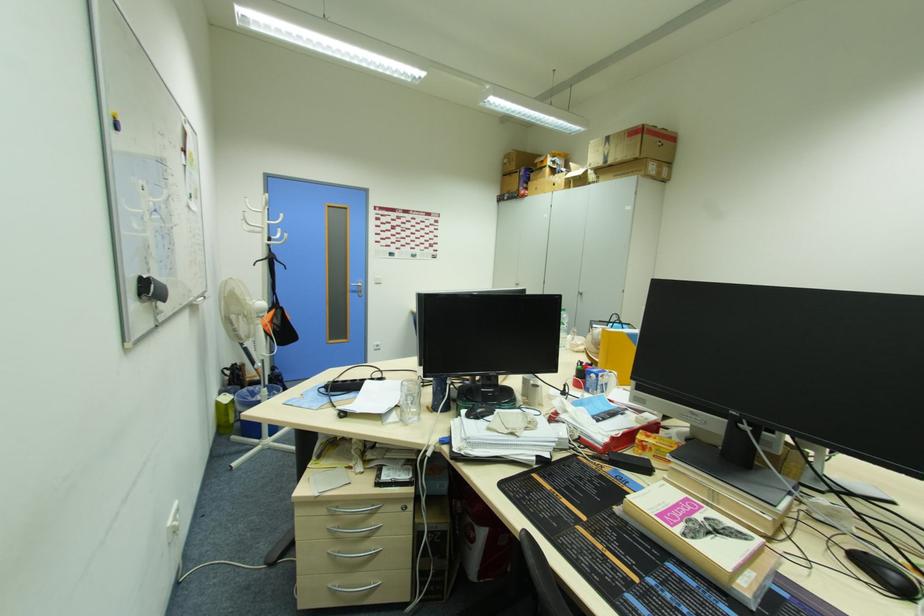
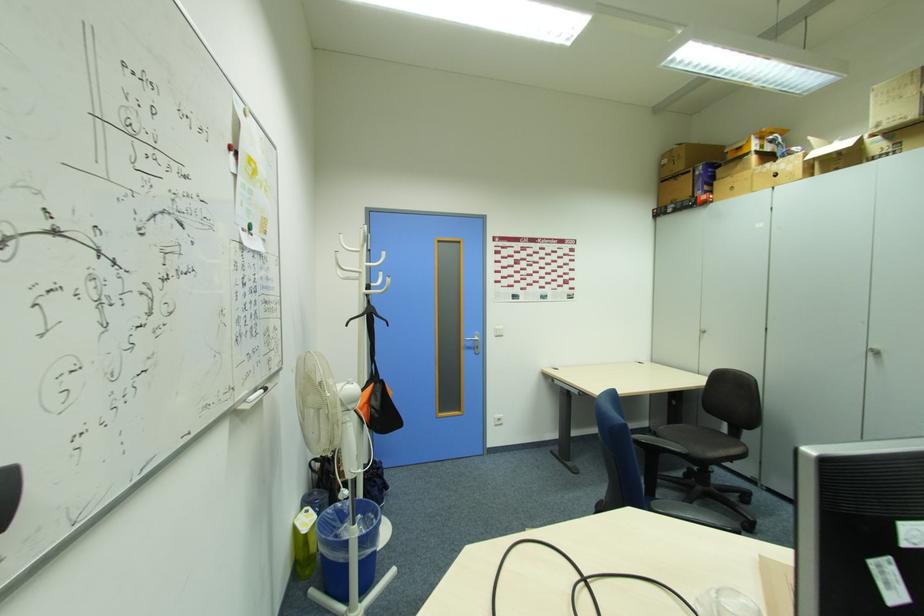
Where in the second image is the point corresponding to point 358,291 from the first image?

(472, 346)